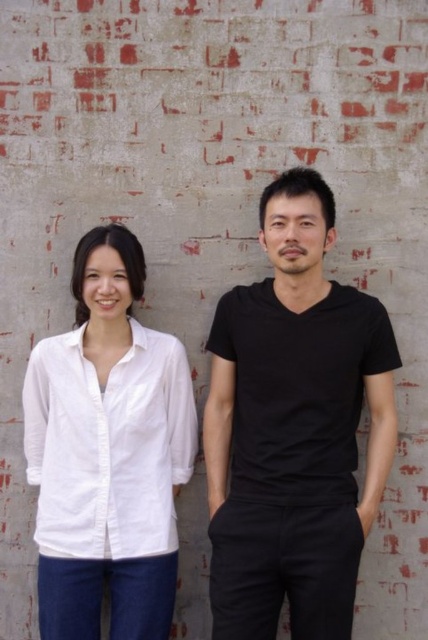
Question: Can you confirm if black matte t-shirt at center is positioned below white cotton shirt at left?

Choices:
 (A) no
 (B) yes

Answer: (A)

Question: Which point is farther to the camera?

Choices:
 (A) (303, 211)
 (B) (130, 449)

Answer: (B)

Question: Which object appears farthest from the camera in this image?

Choices:
 (A) black matte t-shirt at center
 (B) white cotton shirt at left

Answer: (B)

Question: Is black matte t-shirt at center positioned before white cotton shirt at left?

Choices:
 (A) no
 (B) yes

Answer: (B)

Question: Is black matte t-shirt at center below white cotton shirt at left?

Choices:
 (A) no
 (B) yes

Answer: (A)

Question: Which point is farther to the camera?

Choices:
 (A) (x=89, y=426)
 (B) (x=353, y=529)

Answer: (A)